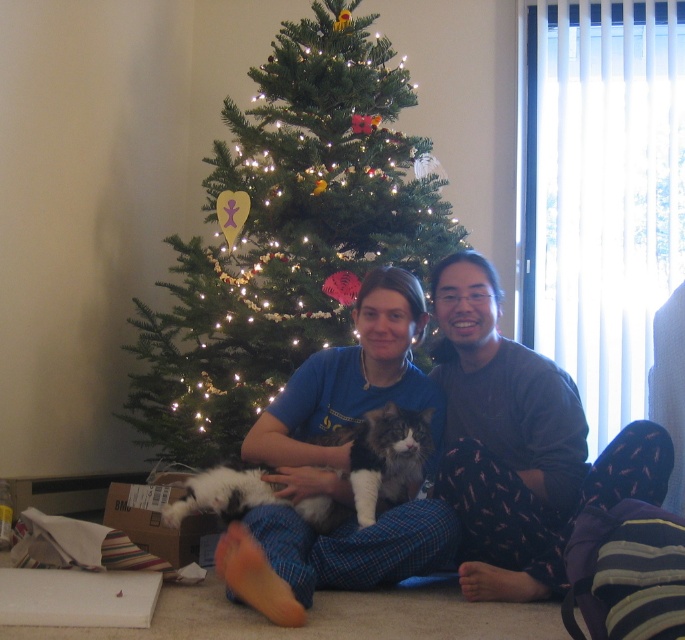
Question: Which object appears farthest from the camera in this image?

Choices:
 (A) fluffy white cat at center
 (B) dark gray fleece pants at center
 (C) blue cotton shirt at center
 (D) green matte christmas tree at center

Answer: (D)

Question: Does dark gray fleece pants at center appear under blue cotton shirt at center?

Choices:
 (A) yes
 (B) no

Answer: (B)

Question: Among these points, which one is nearest to the camera?

Choices:
 (A) (140, 406)
 (B) (362, 289)

Answer: (B)

Question: Can you confirm if green matte christmas tree at center is thinner than blue cotton shirt at center?

Choices:
 (A) yes
 (B) no

Answer: (B)

Question: Does green matte christmas tree at center appear on the right side of dark gray fleece pants at center?

Choices:
 (A) no
 (B) yes

Answer: (A)

Question: Which point is farther to the camera?

Choices:
 (A) (395, 84)
 (B) (538, 464)

Answer: (A)